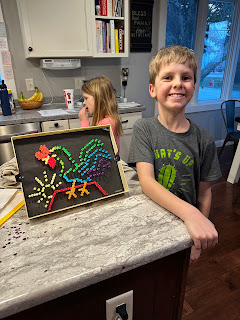
Locate an element on the screen. The width and height of the screenshot is (240, 320). countertop is located at coordinates (87, 231), (29, 114).